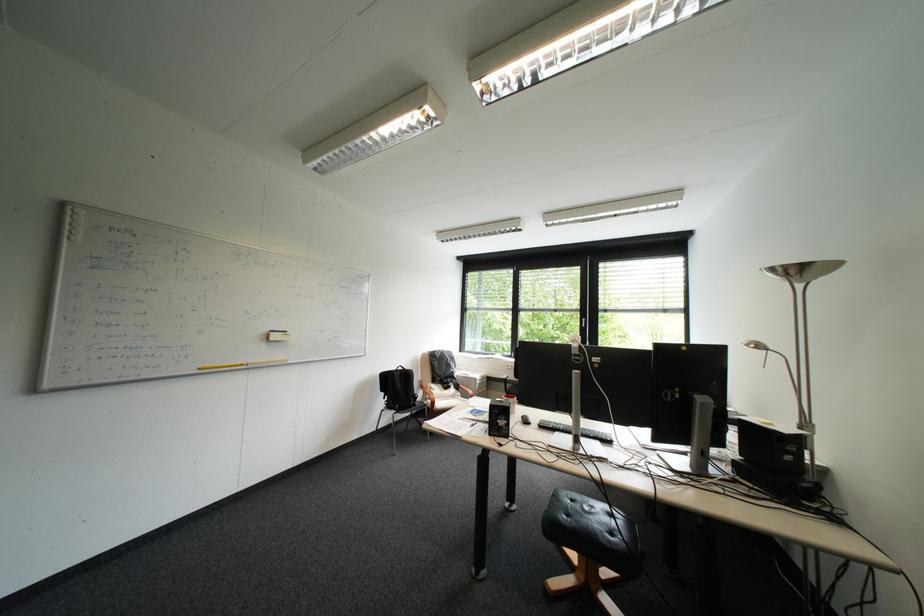
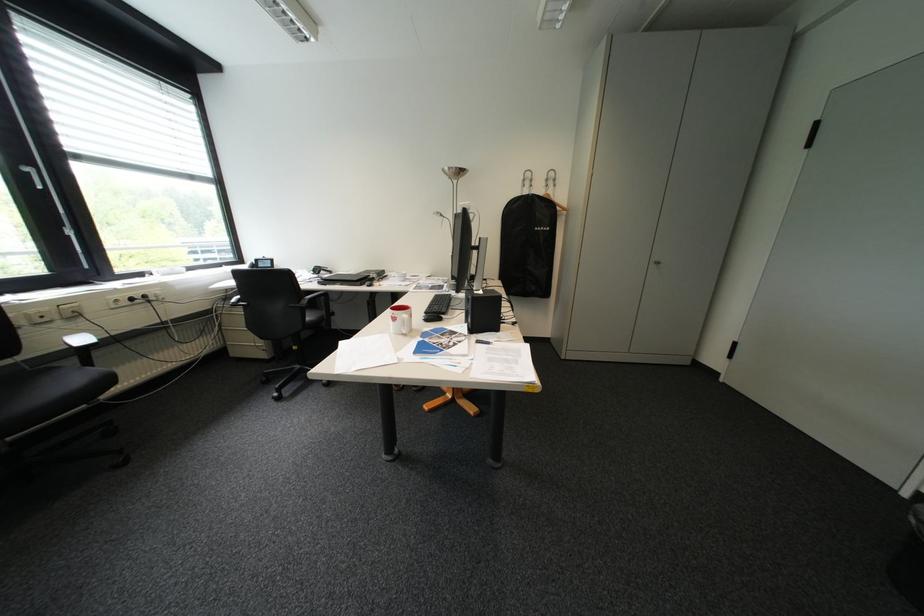
In the second image, find the point that corresponds to (596,320) in the first image.

(41, 169)